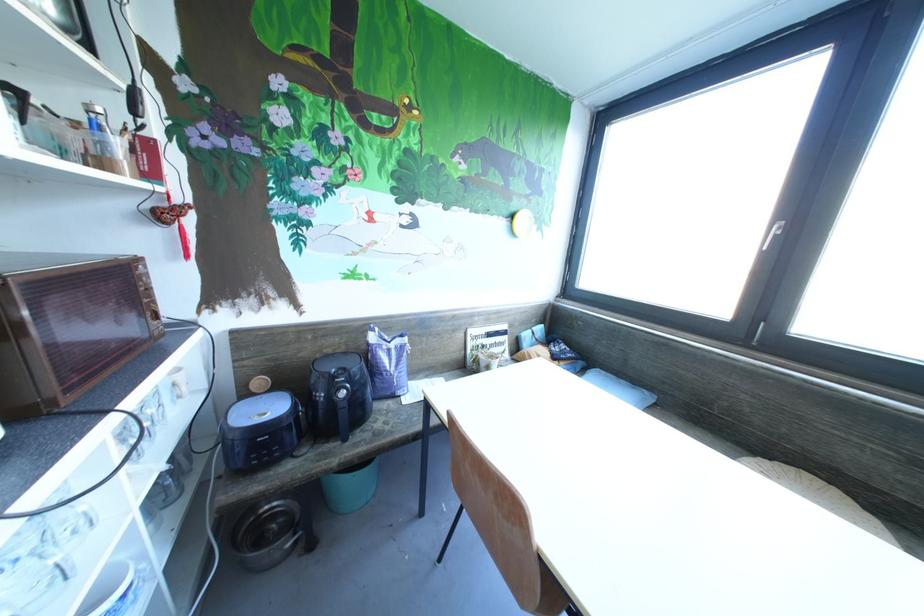
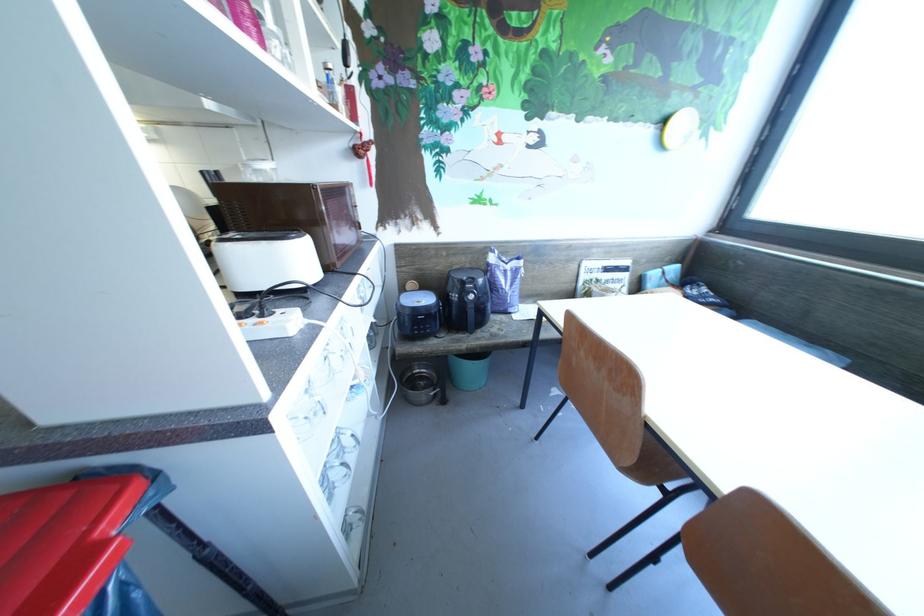
Which direction would the cameraman need to move to produce the second image?

The movement direction of the cameraman is left, backward.